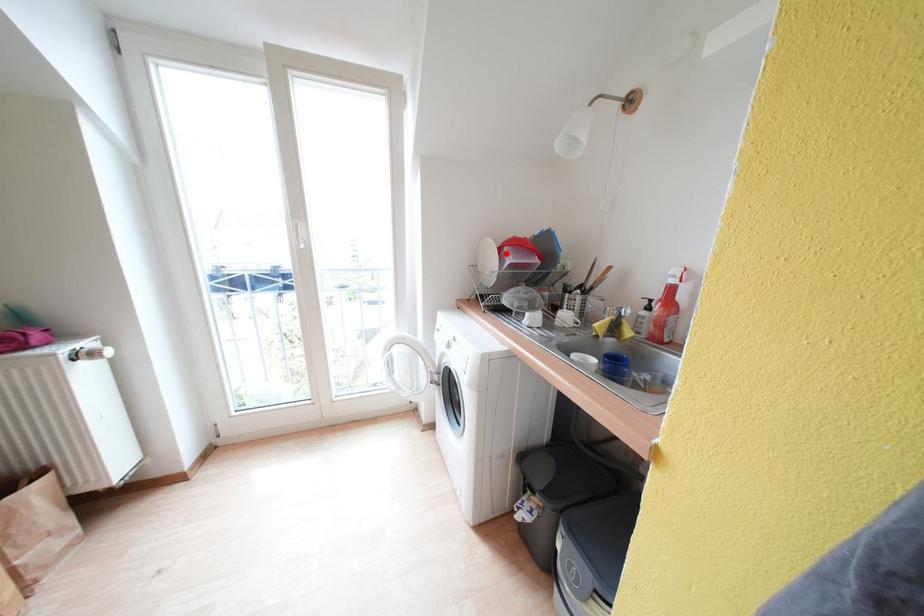
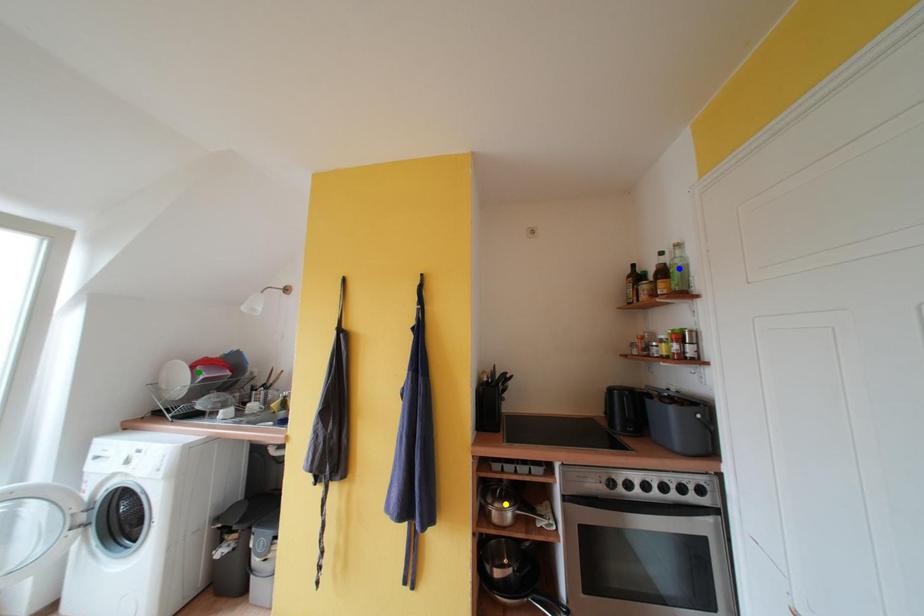
Question: I am providing you with two images of the same scene from different viewpoints. A red point is marked on the first image. You are given multiple points on the second image. Which point in image 2 represents the same 3d spot as the red point in image 1?

Choices:
 (A) blue point
 (B) green point
 (C) yellow point

Answer: (B)